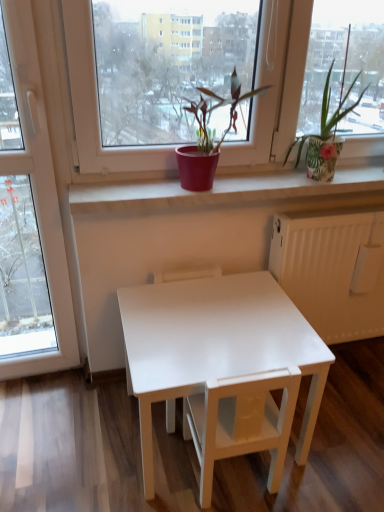
Question: Is white matte chair at center, which appears as the 2th armchair when viewed from the back, located within white glossy table at center?

Choices:
 (A) no
 (B) yes

Answer: (B)

Question: Is white glossy table at center to the right of white matte chair at center, which appears as the 2th armchair when viewed from the back, from the viewer's perspective?

Choices:
 (A) yes
 (B) no

Answer: (B)

Question: Does white glossy table at center have a larger size compared to white matte chair at center, which appears as the 2th armchair when viewed from the back?

Choices:
 (A) no
 (B) yes

Answer: (B)

Question: Is white glossy table at center turned away from white matte chair at center, which appears as the 2th armchair when viewed from the back?

Choices:
 (A) yes
 (B) no

Answer: (A)

Question: Considering the relative positions of white glossy table at center and white matte chair at center, positioned as the 1th armchair in front-to-back order, in the image provided, is white glossy table at center in front of white matte chair at center, positioned as the 1th armchair in front-to-back order,?

Choices:
 (A) yes
 (B) no

Answer: (B)

Question: Is white glossy table at center to the left or to the right of white matte chair at center, positioned as the 1th armchair in front-to-back order, in the image?

Choices:
 (A) right
 (B) left

Answer: (B)

Question: From the image's perspective, is white glossy table at center positioned above or below white matte chair at center, which appears as the 2th armchair when viewed from the back?

Choices:
 (A) above
 (B) below

Answer: (A)

Question: From their relative heights in the image, would you say white glossy table at center is taller or shorter than white matte chair at center, which appears as the 2th armchair when viewed from the back?

Choices:
 (A) short
 (B) tall

Answer: (B)

Question: Do you think white glossy table at center is within white matte chair at center, which appears as the 2th armchair when viewed from the back, or outside of it?

Choices:
 (A) outside
 (B) inside

Answer: (A)

Question: In the image, is white glossy table at center, the first armchair viewed from the back, positioned in front of or behind matte red pot at center, the 1th houseplant when ordered from left to right?

Choices:
 (A) behind
 (B) front

Answer: (A)

Question: From the image's perspective, is white glossy table at center, the first armchair viewed from the back, located above or below matte red pot at center, acting as the second houseplant starting from the right?

Choices:
 (A) above
 (B) below

Answer: (B)

Question: Is white glossy table at center, the 2th armchair from the front, inside or outside of matte red pot at center, acting as the second houseplant starting from the right?

Choices:
 (A) inside
 (B) outside

Answer: (B)

Question: In terms of height, does white glossy table at center, the 2th armchair from the front, look taller or shorter compared to matte red pot at center, the 1th houseplant when ordered from left to right?

Choices:
 (A) tall
 (B) short

Answer: (A)

Question: From the image's perspective, relative to white glossy table at center, is white matte chair at center, which appears as the 2th armchair when viewed from the back, above or below?

Choices:
 (A) below
 (B) above

Answer: (A)

Question: In the image, is white matte chair at center, which appears as the 2th armchair when viewed from the back, positioned in front of or behind white glossy table at center?

Choices:
 (A) behind
 (B) front

Answer: (B)